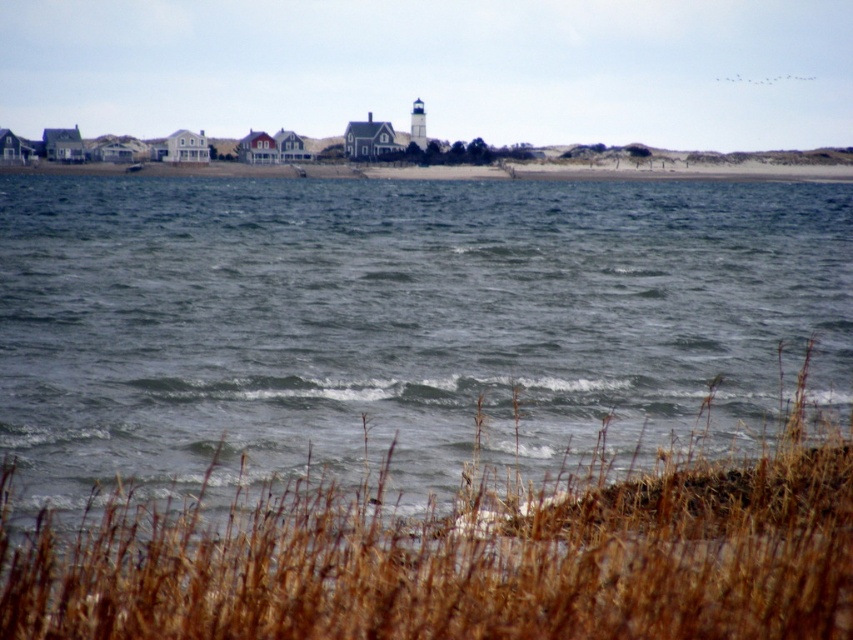
You are standing at the center of the image and want to walk towards the gray water at center. Which direction should you go?

The gray water at center is already at the center of the image, so you are already facing it. You don not need to move in any direction to reach it.

Consider the image. You are a photographer standing at the edge of the dunes. You want to capture a photo of the gray water at center without the brown grass at lower center appearing in the foreground. Is this possible based on their positions?

The gray water at center is positioned over brown grass at lower center, so the brown grass at lower center will be visible in the foreground of the photo. To avoid it, you might need to adjust your angle or move further back to frame the shot differently.

You are standing at the edge of the sandy shoreline in the coastal scene. There is a point marked at coordinates (399,323). Based on the description, where is this point located?

The point marked at coordinates (399,323) is on the gray water at center.